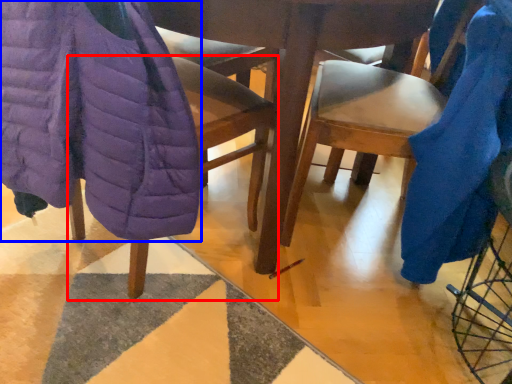
Question: Which object appears farthest to the camera in this image, chair (highlighted by a red box) or blanket (highlighted by a blue box)?

Choices:
 (A) chair
 (B) blanket

Answer: (A)